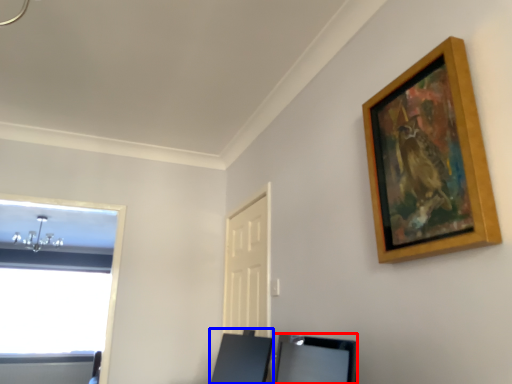
Question: Which object appears closest to the camera in this image, vanity (highlighted by a red box) or vanity (highlighted by a blue box)?

Choices:
 (A) vanity
 (B) vanity

Answer: (A)